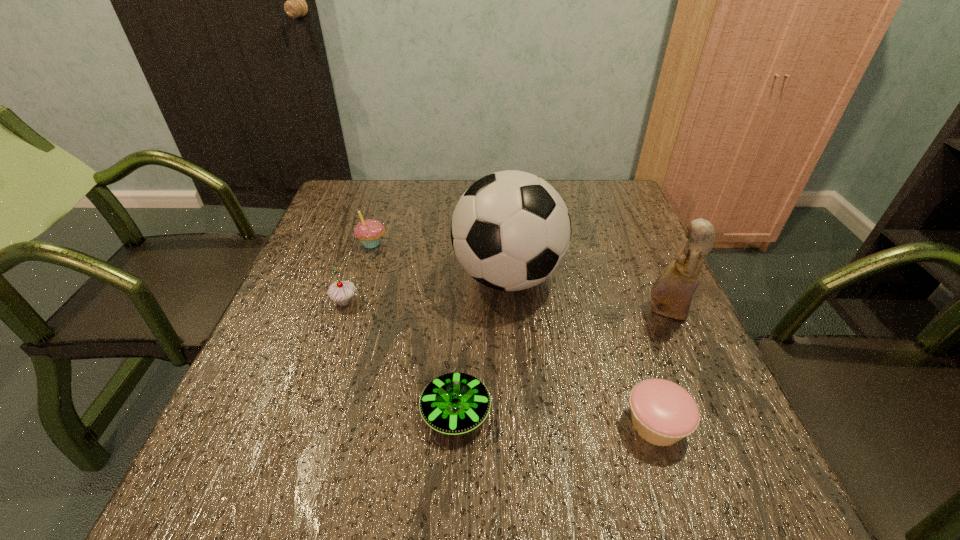
You are a GUI agent. You are given a task and a screenshot of the screen. Output one action in this format:
    pyautogui.click(x=<x>, y=<y>)
    Task: Click on the soccer ball
    The image size is (960, 540).
    Given the screenshot: What is the action you would take?
    pyautogui.click(x=510, y=230)

Identify the location of the rightmost object. Image resolution: width=960 pixels, height=540 pixels. (672, 292).

The height and width of the screenshot is (540, 960). Find the location of `the farthest cupcake`. the farthest cupcake is located at coordinates (369, 232).

Identify the location of the second shortest cupcake. (341, 292).

This screenshot has height=540, width=960. Identify the location of the fourth tallest object. (341, 292).

In order to click on the second object from right to left in this screenshot , I will do `click(662, 412)`.

Locate an element on the screen. This screenshot has width=960, height=540. the shortest cupcake is located at coordinates (662, 412).

At what (x,y) coordinates should I click in order to perform the action: click on saucer. Please return your answer as a coordinate pair (x, y). Looking at the image, I should click on (454, 403).

Image resolution: width=960 pixels, height=540 pixels. I want to click on free spot located on the left of the soccer ball, so click(x=333, y=276).

This screenshot has width=960, height=540. What are the coordinates of `free space located 0.360m on the front-facing side of the rightmost object` in the screenshot? It's located at (483, 312).